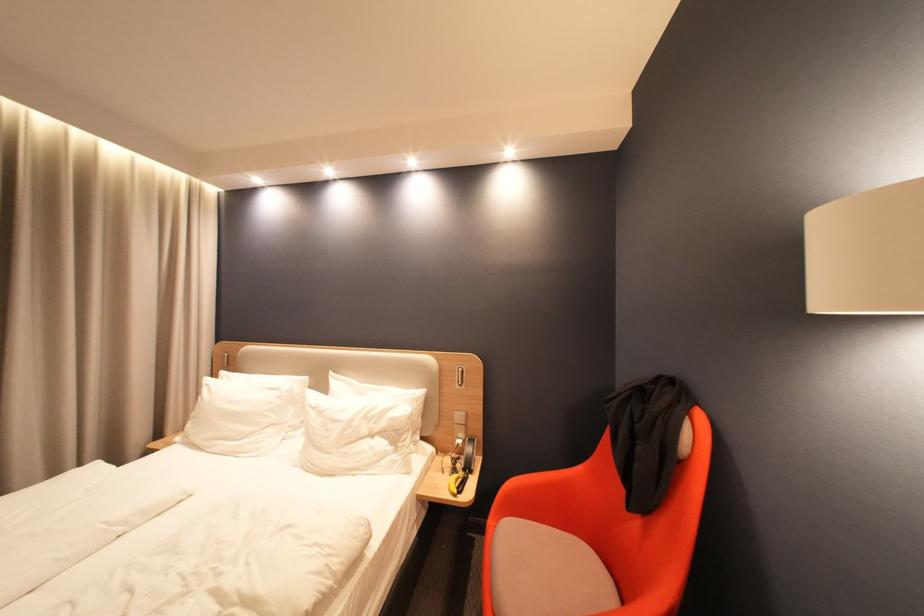
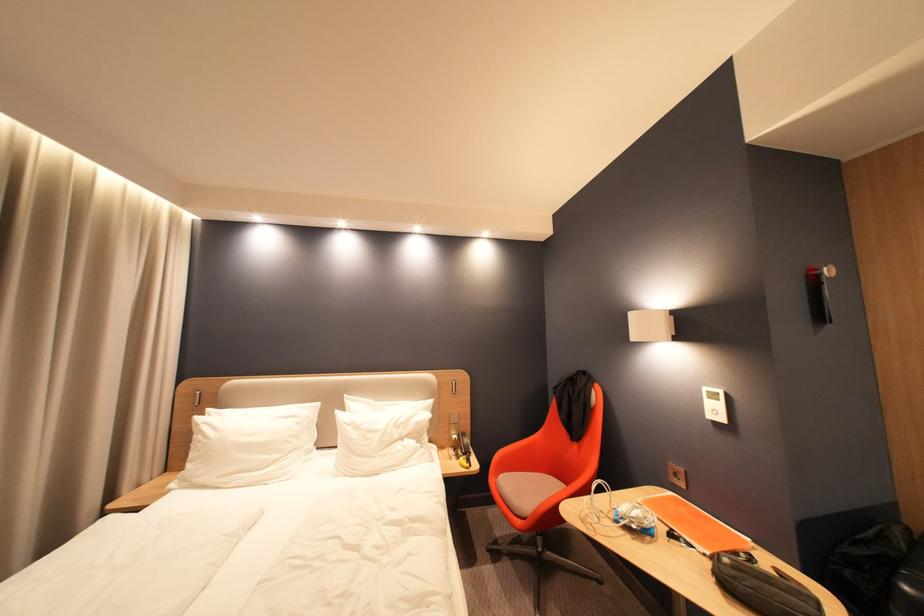
Locate, in the second image, the point that corresponds to (x=435, y=391) in the first image.

(443, 400)